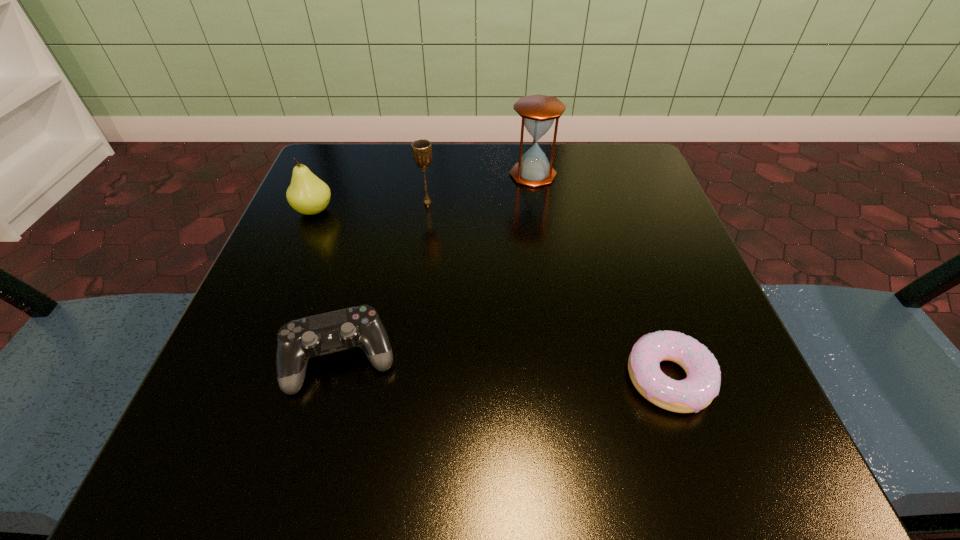
The width and height of the screenshot is (960, 540). Identify the location of the tallest object. (538, 112).

At what (x,y) coordinates should I click in order to perform the action: click on the farthest object. Please return your answer as a coordinate pair (x, y). Image resolution: width=960 pixels, height=540 pixels. Looking at the image, I should click on (538, 112).

The width and height of the screenshot is (960, 540). I want to click on chalice, so click(x=421, y=149).

Where is `the leftmost object`? The width and height of the screenshot is (960, 540). the leftmost object is located at coordinates (307, 194).

You are a GUI agent. You are given a task and a screenshot of the screen. Output one action in this format:
    pyautogui.click(x=<x>, y=<y>)
    Task: Click on the fourth tallest object
    This screenshot has height=540, width=960.
    Given the screenshot: What is the action you would take?
    pyautogui.click(x=299, y=340)

Locate an element on the screen. The image size is (960, 540). the shortest object is located at coordinates (702, 384).

Identify the location of the rightmost object. coord(702,384).

This screenshot has height=540, width=960. In order to click on vacant area situated 0.130m on the front of the hourglass in this screenshot , I will do `click(541, 228)`.

Locate an element on the screen. This screenshot has width=960, height=540. vacant space situated on the right of the chalice is located at coordinates (571, 202).

Where is `free spot located 0.370m on the front of the leftmost object`? free spot located 0.370m on the front of the leftmost object is located at coordinates (232, 402).